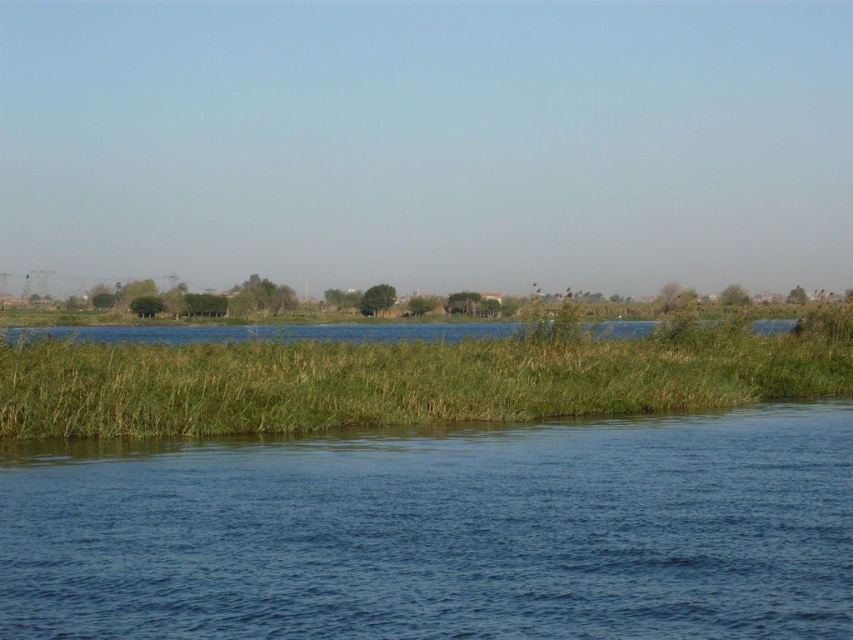
Question: Which point appears farthest from the camera in this image?

Choices:
 (A) (171, 380)
 (B) (445, 436)
 (C) (173, 332)

Answer: (C)

Question: Can you confirm if blue liquid water at center is smaller than green grassy at lower center?

Choices:
 (A) yes
 (B) no

Answer: (A)

Question: Which point appears closest to the camera in this image?

Choices:
 (A) (844, 390)
 (B) (335, 456)
 (C) (62, 336)

Answer: (B)

Question: Does blue liquid water at center have a lesser width compared to green grassy at lower center?

Choices:
 (A) yes
 (B) no

Answer: (A)

Question: Is green grassy at lower center in front of green grassy river at center?

Choices:
 (A) yes
 (B) no

Answer: (A)

Question: Based on their relative distances, which object is nearer to the green grassy river at center?

Choices:
 (A) green grassy at lower center
 (B) blue liquid water at center

Answer: (A)